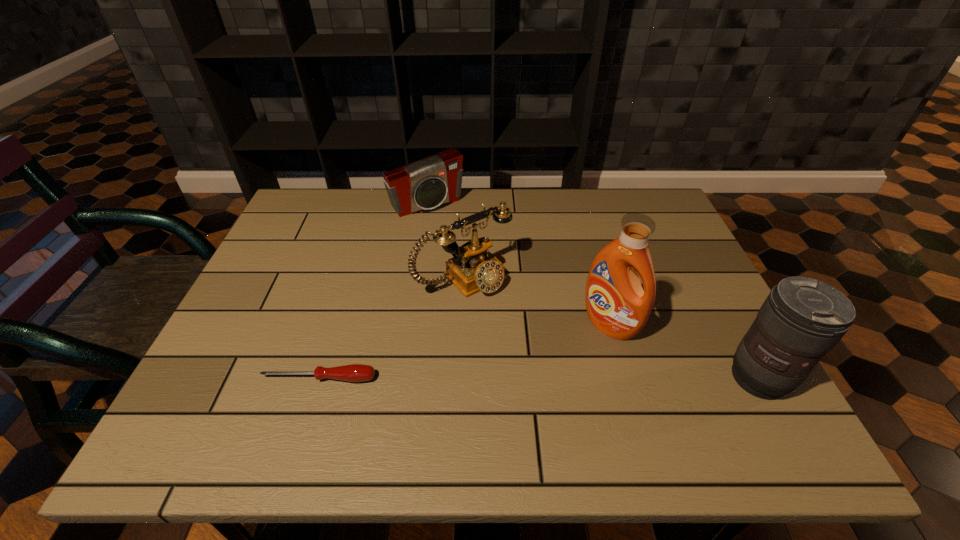
The image size is (960, 540). Find the location of `telephoto lens at the near edge`. telephoto lens at the near edge is located at coordinates (802, 319).

Locate an element on the screen. This screenshot has height=540, width=960. object present at the left edge is located at coordinates (354, 372).

The height and width of the screenshot is (540, 960). In order to click on object that is at the right edge in this screenshot , I will do coord(802,319).

What are the coordinates of `object positioned at the near left corner` in the screenshot? It's located at (354, 372).

Find the location of `object present at the near right corner`. object present at the near right corner is located at coordinates (802, 319).

Image resolution: width=960 pixels, height=540 pixels. What are the coordinates of `vacant space at the far edge` in the screenshot? It's located at (456, 230).

Locate an element on the screen. The image size is (960, 540). free space at the near edge is located at coordinates (396, 399).

Locate an element on the screen. This screenshot has width=960, height=540. vacant space at the left edge of the desktop is located at coordinates (315, 244).

You are a GUI agent. You are given a task and a screenshot of the screen. Output one action in this format:
    pyautogui.click(x=<x>, y=<y>)
    Task: Click on the vacant space at the right edge
    
    Given the screenshot: What is the action you would take?
    pyautogui.click(x=694, y=269)

What are the coordinates of `free point between the shortest object and the rightmost object` in the screenshot? It's located at (540, 378).